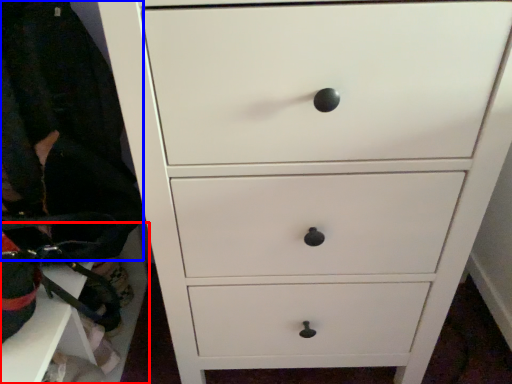
Question: Among these objects, which one is nearest to the camera, cabinetry (highlighted by a red box) or clothing (highlighted by a blue box)?

Choices:
 (A) cabinetry
 (B) clothing

Answer: (B)